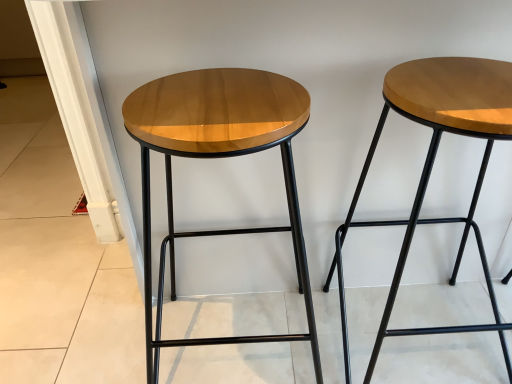
At what (x,y) coordinates should I click in order to perform the action: click on vacant space situated on the left part of glossy wood stool at left, the 1th stool positioned from the left. Please return your answer as a coordinate pair (x, y). Looking at the image, I should click on (97, 327).